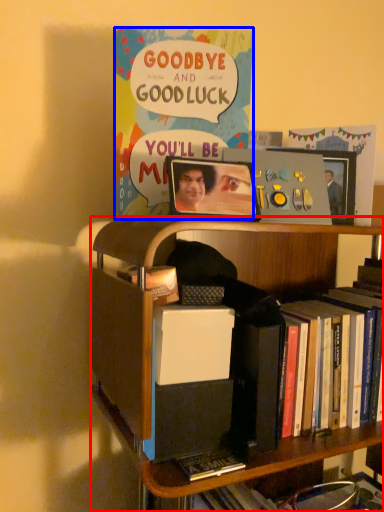
Question: Among these objects, which one is nearest to the camera, bookcase (highlighted by a red box) or comic book (highlighted by a blue box)?

Choices:
 (A) bookcase
 (B) comic book

Answer: (A)